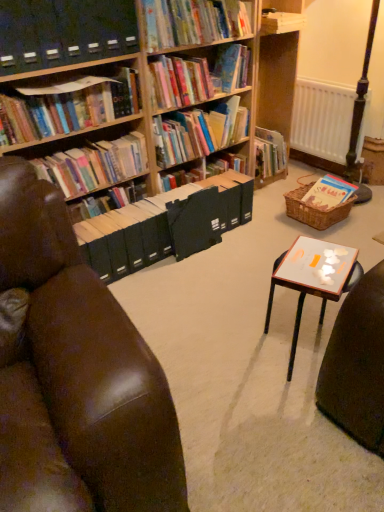
The image size is (384, 512). I want to click on free point above woven brown basket at right (from a real-world perspective), so click(x=322, y=192).